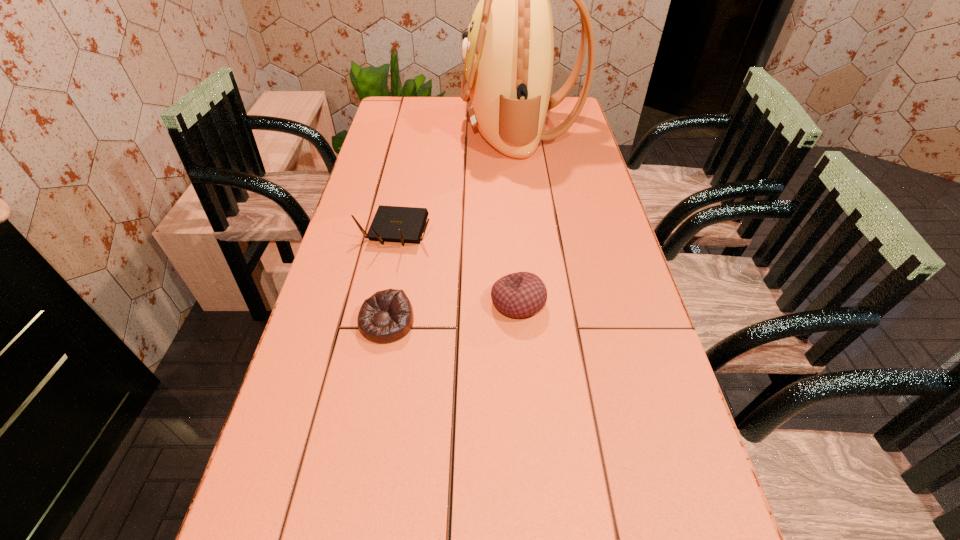
The image size is (960, 540). In order to click on unoccupied area between the shorter beanbag and the router in this screenshot , I will do `click(392, 277)`.

Locate an element on the screen. free space between the shorter beanbag and the router is located at coordinates [392, 277].

Identify the location of free spot between the tallest object and the taller beanbag. [x=518, y=215].

The image size is (960, 540). Find the location of `unoccupied position between the taller beanbag and the shortest object`. unoccupied position between the taller beanbag and the shortest object is located at coordinates (452, 313).

Where is `unoccupied area between the third nearest object and the shortest object`? This screenshot has height=540, width=960. unoccupied area between the third nearest object and the shortest object is located at coordinates (x=392, y=277).

Find the location of a particular element. free space between the farthest object and the shortest object is located at coordinates (453, 226).

Where is `unoccupied position between the second farthest object and the farthest object`? unoccupied position between the second farthest object and the farthest object is located at coordinates (458, 180).

Locate an element on the screen. This screenshot has height=540, width=960. empty space between the right beanbag and the farthest object is located at coordinates (518, 215).

At what (x,y) coordinates should I click in order to perform the action: click on free space between the right beanbag and the router. Please return your answer as a coordinate pair (x, y). The height and width of the screenshot is (540, 960). Looking at the image, I should click on (457, 267).

You are a GUI agent. You are given a task and a screenshot of the screen. Output one action in this format:
    pyautogui.click(x=<x>, y=<y>)
    Task: Click on the free spot between the left beanbag and the farthest object
    
    Given the screenshot: What is the action you would take?
    pyautogui.click(x=453, y=226)